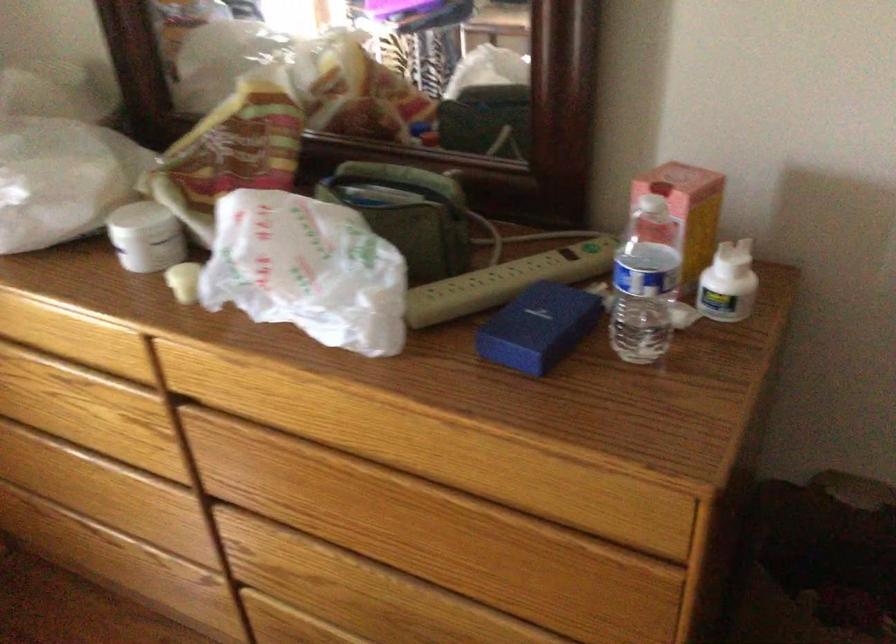
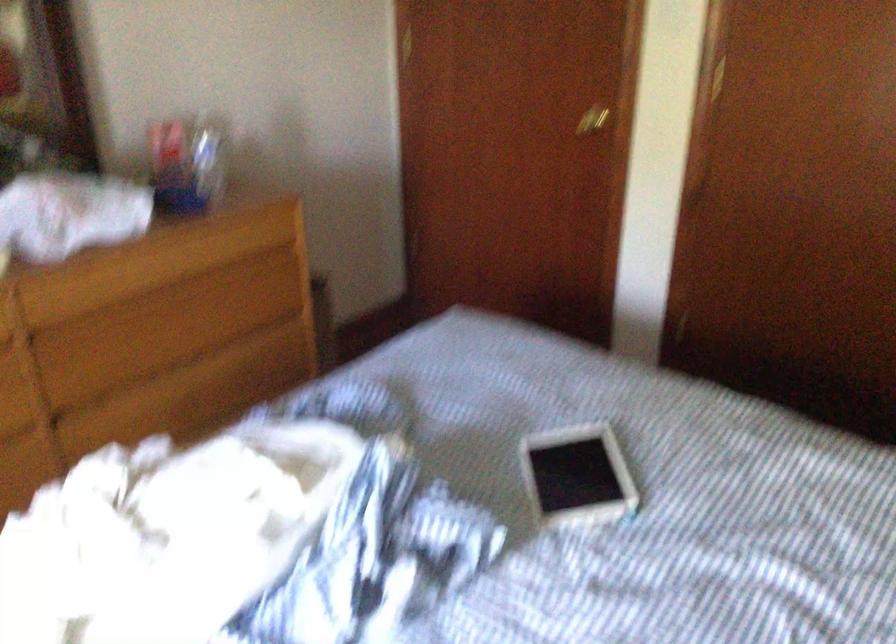
Find the pixel in the second image that matches point 633,279 in the first image.

(208, 156)